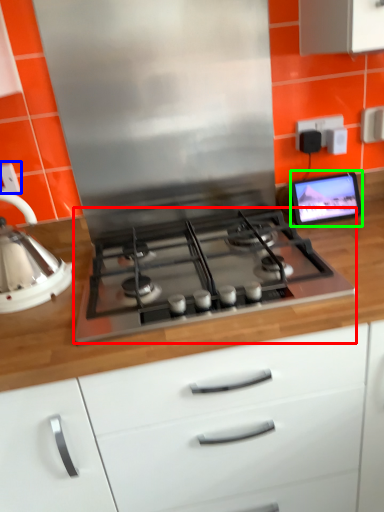
Question: Estimate the real-world distances between objects in this image. Which object is farther from gas stove (highlighted by a red box), electric outlet (highlighted by a blue box) or computer monitor (highlighted by a green box)?

Choices:
 (A) electric outlet
 (B) computer monitor

Answer: (A)